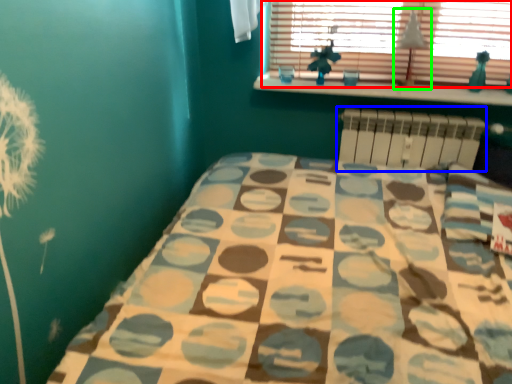
Question: Which is nearer to the window (highlighted by a red box)? radiator (highlighted by a blue box) or lamp (highlighted by a green box).

Choices:
 (A) radiator
 (B) lamp

Answer: (B)